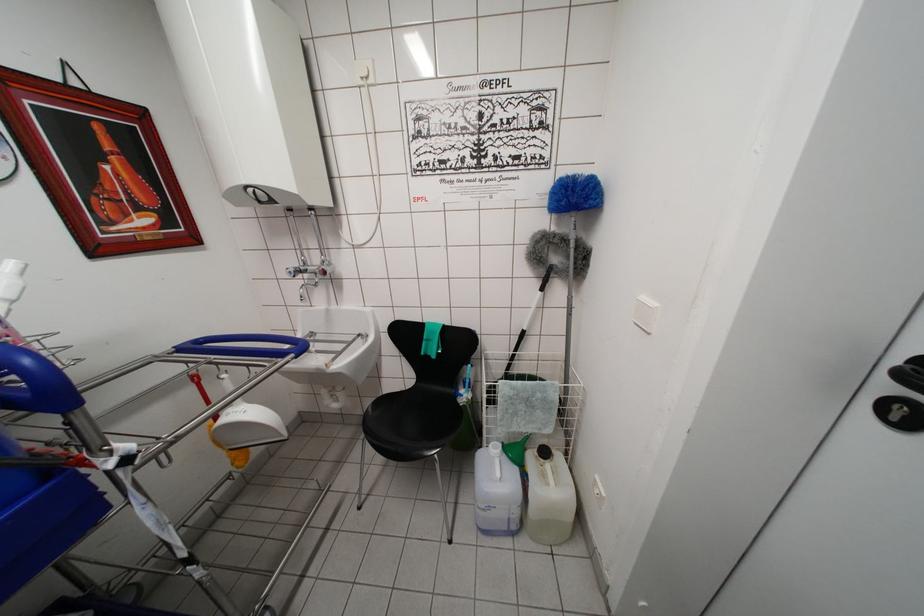
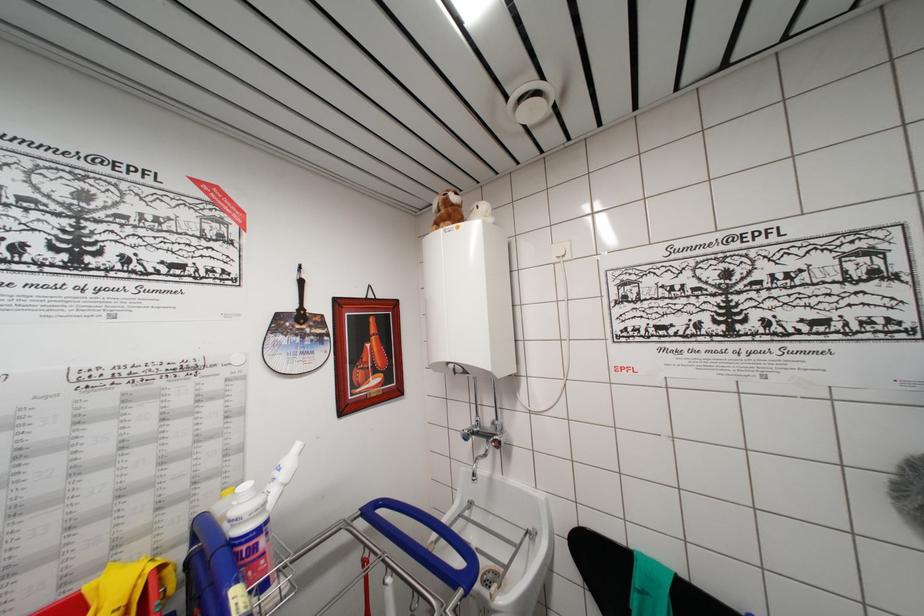
Based on the continuous images, in which direction is the camera rotating?

The camera's rotation is toward left-up.